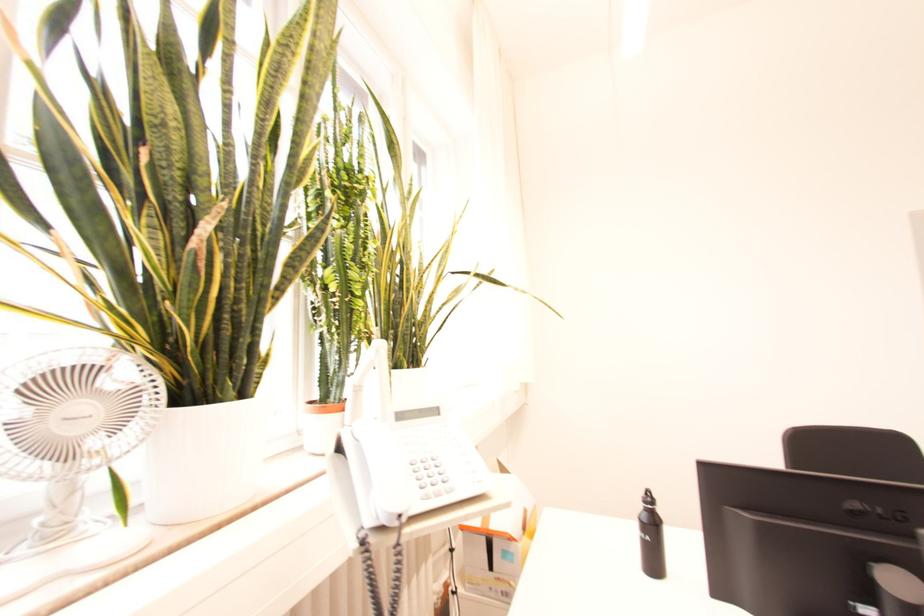
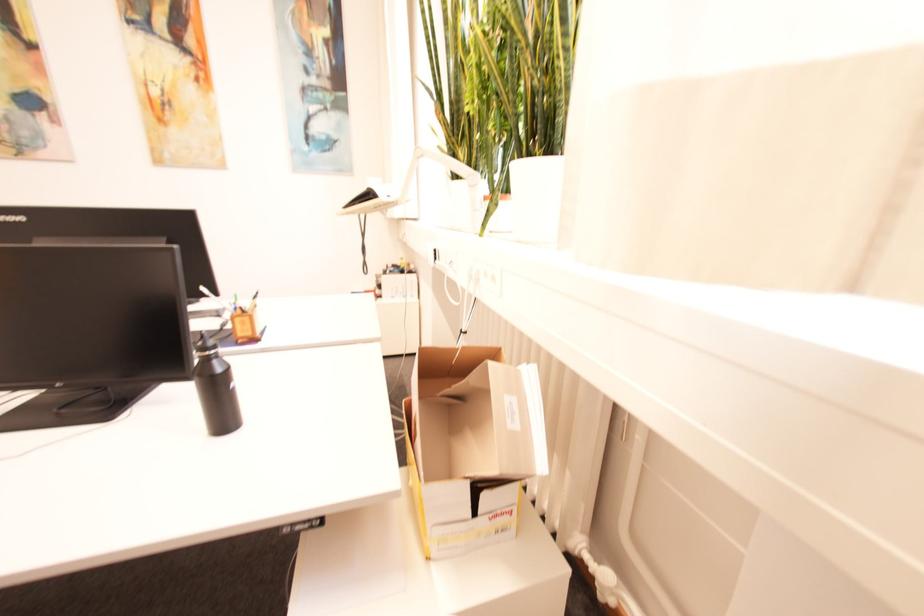
Question: I am providing you with two images of the same scene from different viewpoints. Which of the following objects are not visible in image2?

Choices:
 (A) open cardboard box
 (B) yellow plush toy
 (C) black water bottle
 (D) desk lamp head

Answer: (C)